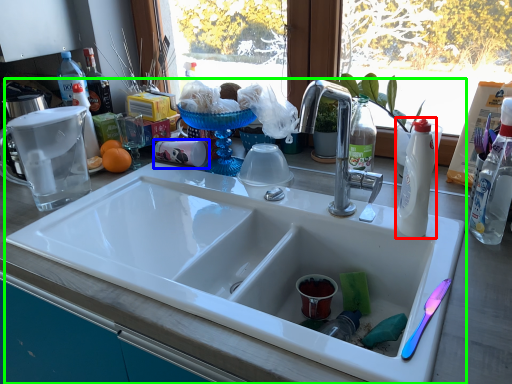
Question: Which object is positioned closest to bottle (highlighted by a red box)? Select from coffee cup (highlighted by a blue box) and sink (highlighted by a green box).

Choices:
 (A) coffee cup
 (B) sink

Answer: (B)